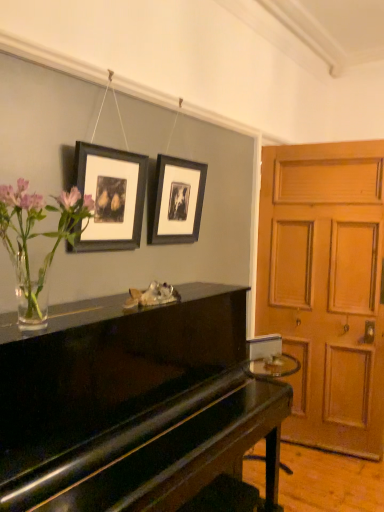
The height and width of the screenshot is (512, 384). I want to click on vacant area situated below matte black picture frame at upper center, the 1th picture frame viewed from the left (from a real-world perspective), so click(x=103, y=296).